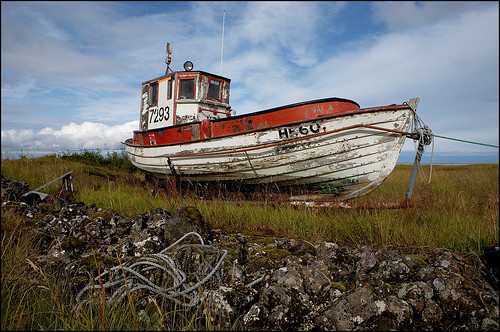
The height and width of the screenshot is (332, 500). In order to click on light in this screenshot , I will do `click(188, 66)`.